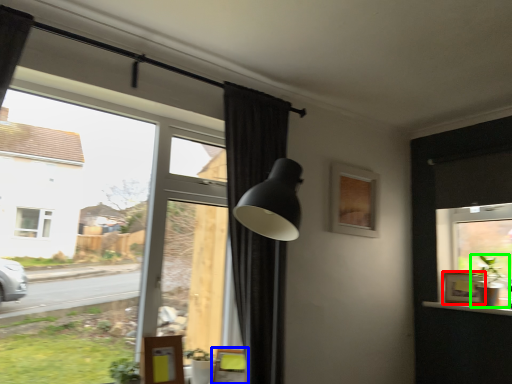
Question: Estimate the real-world distances between objects in this image. Which object is closer to picture frame (highlighted by a red box), swivel chair (highlighted by a blue box) or houseplant (highlighted by a green box)?

Choices:
 (A) swivel chair
 (B) houseplant

Answer: (B)